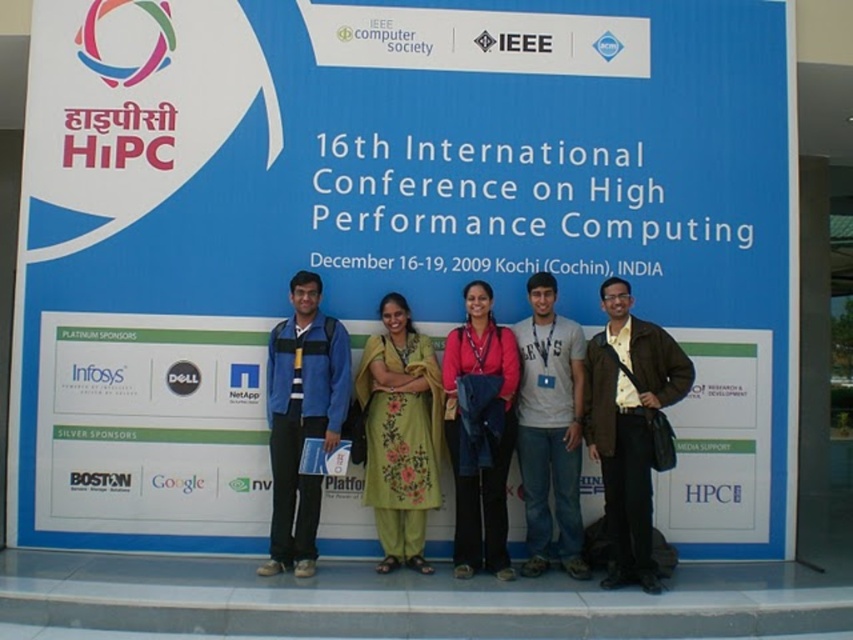
Question: Is the position of brown leather jacket at center less distant than that of green floral dress at center?

Choices:
 (A) no
 (B) yes

Answer: (B)

Question: Does brown leather jacket at center appear on the right side of pink fabric dress at center?

Choices:
 (A) yes
 (B) no

Answer: (A)

Question: Observing the image, what is the correct spatial positioning of blue fabric jacket at center in reference to gray cotton t-shirt at center?

Choices:
 (A) below
 (B) above

Answer: (B)

Question: Which point is closer to the camera taking this photo?

Choices:
 (A) (488, 554)
 (B) (641, 452)

Answer: (B)

Question: Which of the following is the farthest from the observer?

Choices:
 (A) (453, 556)
 (B) (329, 364)
 (C) (437, 403)

Answer: (A)

Question: Estimate the real-world distances between objects in this image. Which object is farther from the gray cotton t-shirt at center?

Choices:
 (A) green floral dress at center
 (B) pink fabric dress at center
 (C) blue fabric jacket at center

Answer: (C)